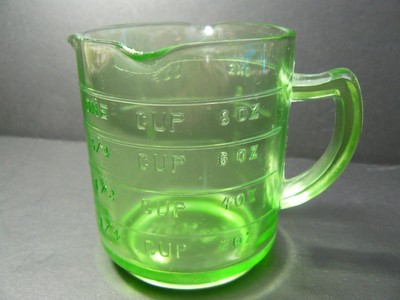
The height and width of the screenshot is (300, 400). Find the location of `handle of cup`. handle of cup is located at coordinates (358, 111).